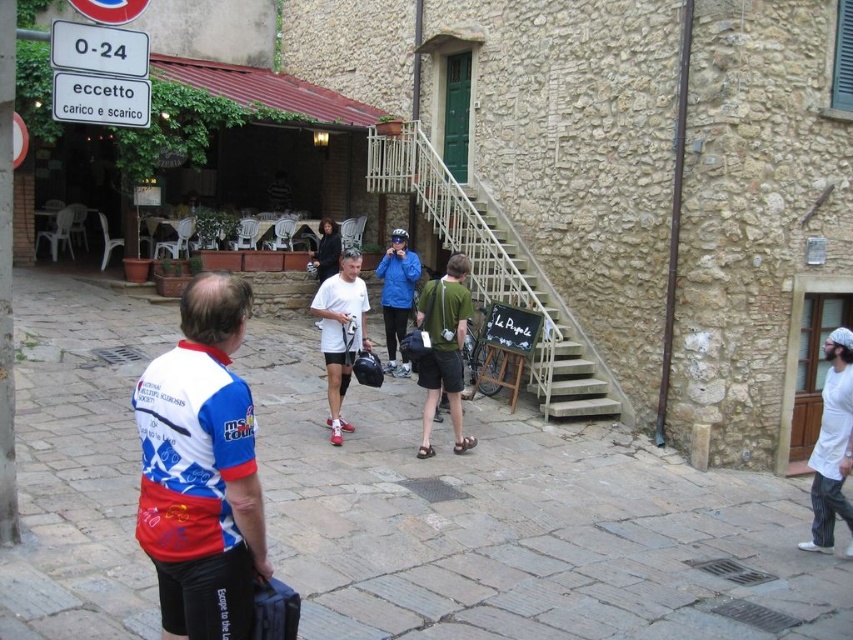
You are standing in the town square and want to place a small potted plant between the brown stone pavement at center and the white plastic sign at upper center. Which object should the plant be closer to based on their heights?

The brown stone pavement at center is much taller than the white plastic sign at upper center, so the plant should be placed closer to the white plastic sign at upper center to balance their heights.